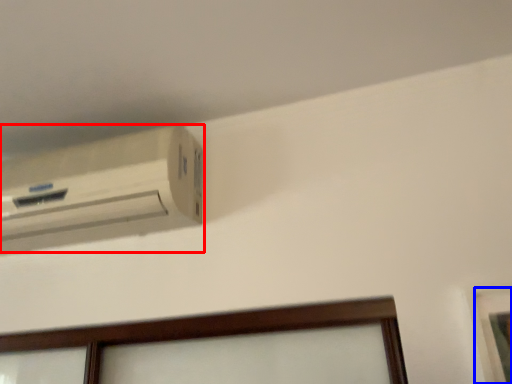
Question: Which object appears farthest to the camera in this image, air conditioning (highlighted by a red box) or picture frame (highlighted by a blue box)?

Choices:
 (A) air conditioning
 (B) picture frame

Answer: (A)